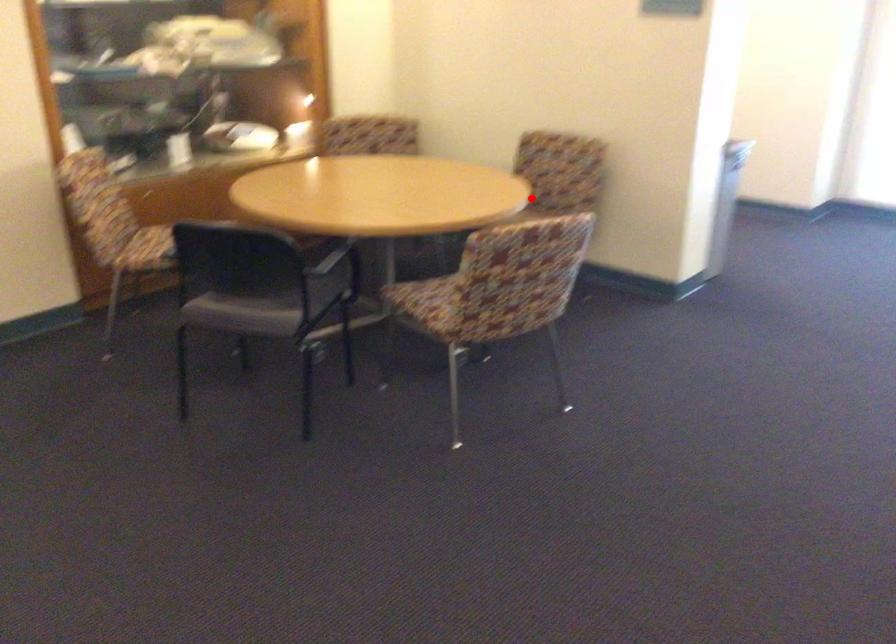
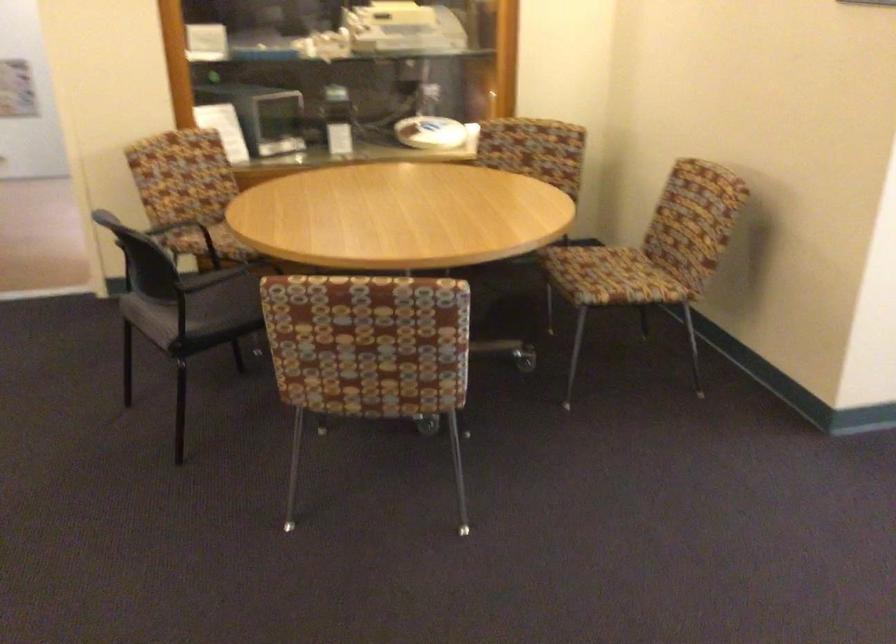
Where in the second image is the point corresponding to the highlighted location from the first image?

(652, 254)